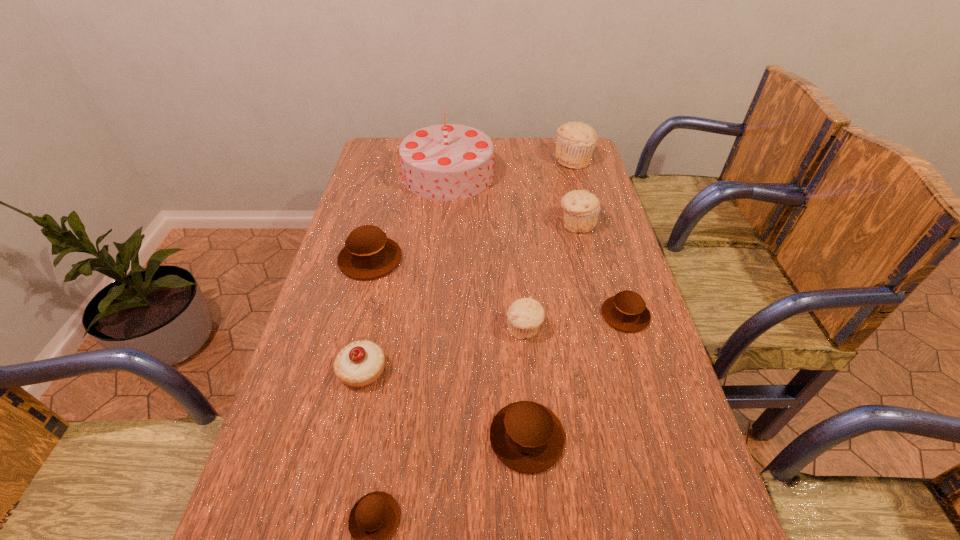
Identify the location of the third brown muffin from left to right. (526, 436).

This screenshot has height=540, width=960. What are the coordinates of `beige pastry` in the screenshot? It's located at [x=359, y=364].

What are the coordinates of `the third nearest object` in the screenshot? It's located at (359, 364).

This screenshot has height=540, width=960. Identify the location of the eighth tallest object. (626, 311).

Where is `the rightmost brown muffin`? The image size is (960, 540). the rightmost brown muffin is located at coordinates (626, 311).

Find the location of `vacant point located on the right of the birthday cake`. vacant point located on the right of the birthday cake is located at coordinates (517, 174).

Find the location of a particular element. free space located 0.390m on the left of the second tallest object is located at coordinates (448, 160).

Locate an element on the screen. The height and width of the screenshot is (540, 960). vacant space located 0.220m on the back of the third farthest object is located at coordinates (564, 175).

Where is `free space located 0.390m on the back of the farthest brown muffin`? free space located 0.390m on the back of the farthest brown muffin is located at coordinates (394, 169).

Where is `free space located on the left of the leftmost beige muffin`? This screenshot has width=960, height=540. free space located on the left of the leftmost beige muffin is located at coordinates (358, 329).